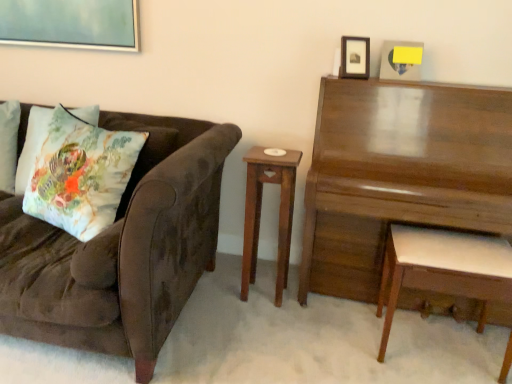
The image size is (512, 384). In order to click on free space that is in between white wood stool at right and glossy wood piano at upper right in this screenshot , I will do `click(362, 346)`.